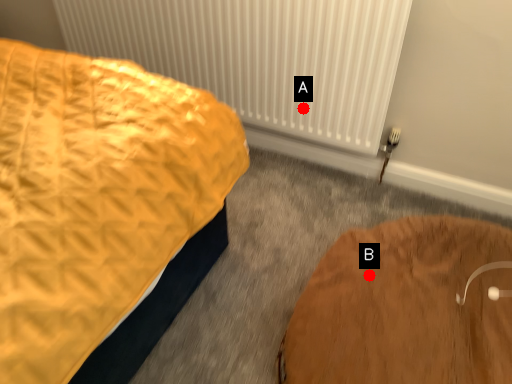
Question: Two points are circled on the image, labeled by A and B beside each circle. Which point is closer to the camera?

Choices:
 (A) A is closer
 (B) B is closer

Answer: (B)